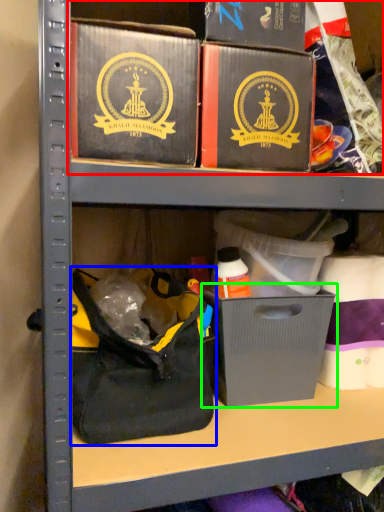
Question: Based on their relative distances, which object is farther from collection (highlighted by a red box)? Choose from handbag (highlighted by a blue box) and cardboard box (highlighted by a green box).

Choices:
 (A) handbag
 (B) cardboard box

Answer: (A)